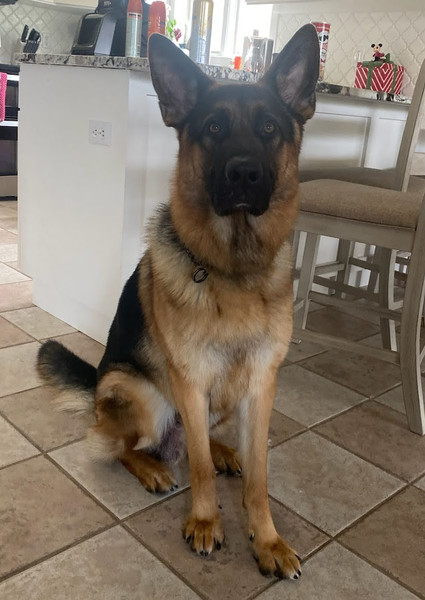
Image resolution: width=425 pixels, height=600 pixels. Find the location of `different coloured tiles`. different coloured tiles is located at coordinates (44, 497).